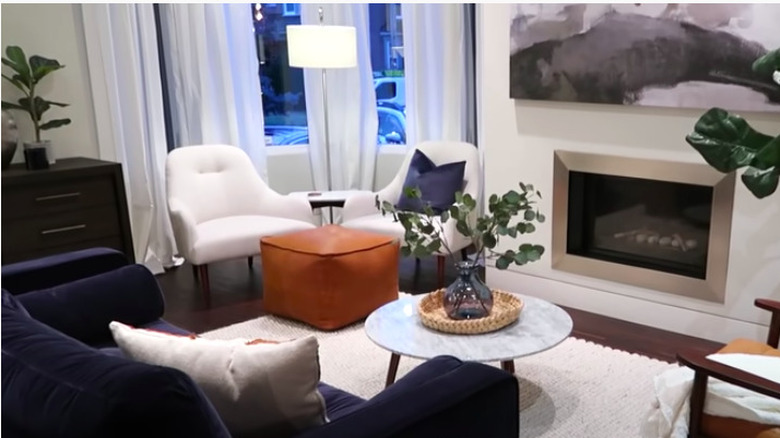
At what (x,y) coordinates should I click in order to perform the action: click on rug. Please return your answer as a coordinate pair (x, y). The height and width of the screenshot is (438, 780). Looking at the image, I should click on (578, 412).